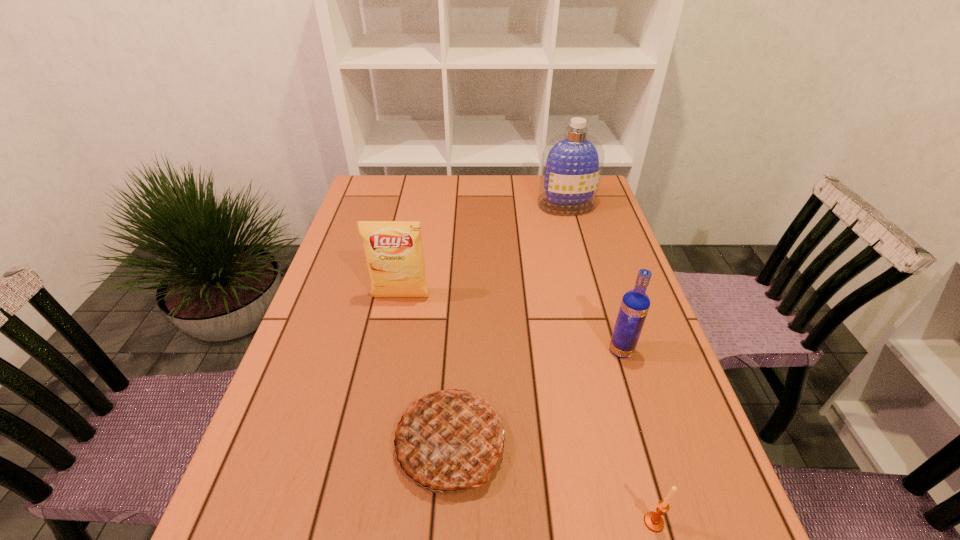
At what (x,y) coordinates should I click in order to perform the action: click on vacant space situated on the front of the vodka. Please return your answer as a coordinate pair (x, y). The height and width of the screenshot is (540, 960). Looking at the image, I should click on (671, 512).

Locate an element on the screen. free space located 0.060m on the back of the second nearest object is located at coordinates (454, 373).

The width and height of the screenshot is (960, 540). Find the location of `vacant area located 0.070m on the right of the candle_holder`. vacant area located 0.070m on the right of the candle_holder is located at coordinates (706, 522).

Where is `object that is at the far edge`? The image size is (960, 540). object that is at the far edge is located at coordinates (572, 162).

Find the location of `object that is at the left edge`. object that is at the left edge is located at coordinates (394, 253).

At what (x,y) coordinates should I click in order to perform the action: click on cleansing agent located in the right edge section of the desktop. Please return your answer as a coordinate pair (x, y). Image resolution: width=960 pixels, height=540 pixels. Looking at the image, I should click on (572, 162).

At what (x,y) coordinates should I click in order to perform the action: click on vodka that is at the right edge. Please return your answer as a coordinate pair (x, y). Image resolution: width=960 pixels, height=540 pixels. Looking at the image, I should click on [635, 304].

Identify the location of candle_holder that is at the right edge. The height and width of the screenshot is (540, 960). [x=654, y=522].

What are the coordinates of `object at the far right corner` in the screenshot? It's located at (572, 162).

Where is `vacant space at the far edge of the desktop`? The height and width of the screenshot is (540, 960). vacant space at the far edge of the desktop is located at coordinates (494, 205).